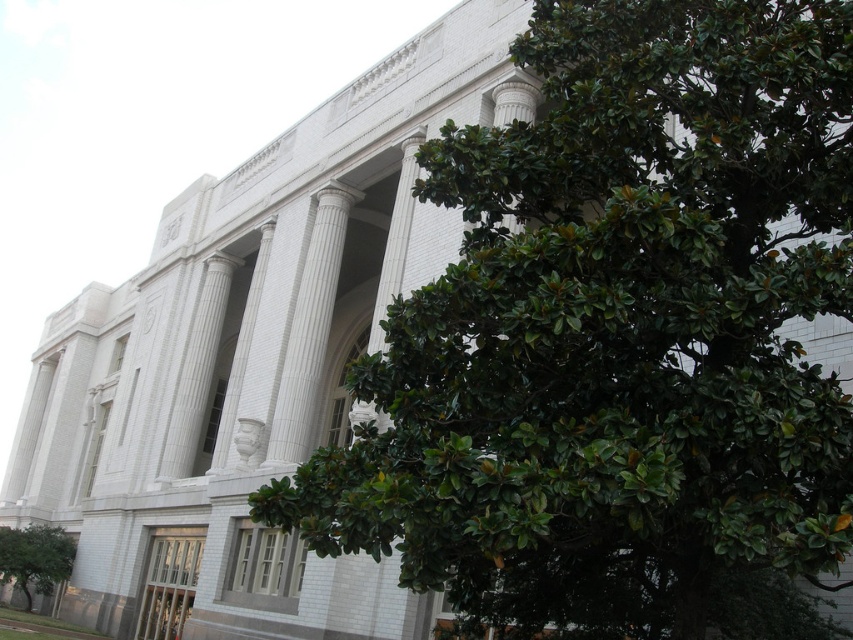
You are planning to install a new pathway between the green leafy tree at center and the green leafy tree at lower left. The pathway requires a minimum of 70 meters of space. Based on the image, can you confirm if there is enough space between them to install the pathway?

The green leafy tree at center and the green leafy tree at lower left are 72.39 meters apart from each other, which exceeds the required 70 meters. Therefore, there is sufficient space to install the pathway between them.

Consider the image. You are standing in front of the building and want to walk towards the green leafy tree at center. Which direction should you move to get closer to it compared to the green leafy tree at lower left?

The green leafy tree at center is closer to the viewer than the green leafy tree at lower left, so you should move forward towards the building to get closer to the green leafy tree at center.